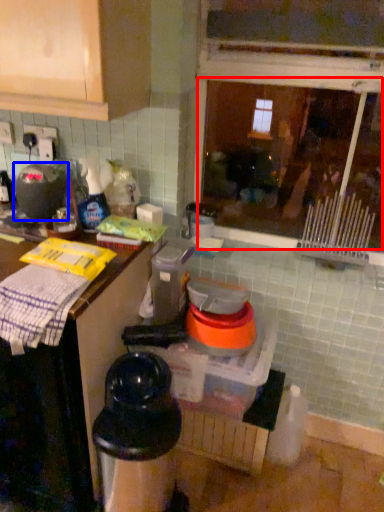
Question: Which of the following is the closest to the observer, window (highlighted by a red box) or appliance (highlighted by a blue box)?

Choices:
 (A) window
 (B) appliance

Answer: (A)